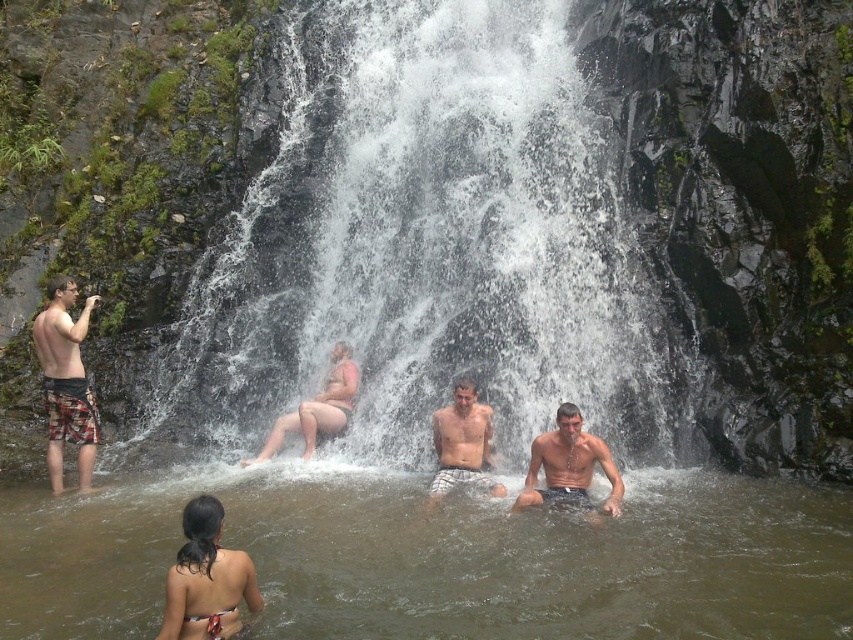
You are a photographer trying to capture both the multicolored bikini at lower left and the smooth tan skin at center in a single shot. Which object should you focus on first to ensure both are in frame?

The multicolored bikini at lower left is larger in size than the smooth tan skin at center, so you should focus on the multicolored bikini at lower left first to ensure both are in frame.

You are a photographer trying to capture the group at the waterfall. You notice the gray plaid shorts at center and the smooth tan skin at center are both in your frame. Which object should you focus on if you want to ensure the larger one is sharp?

You should focus on the gray plaid shorts at center because it is bigger than the smooth tan skin at center, making it the larger object in the frame.

What object is located at the point with coordinates (206, 579) in the image?

The multicolored bikini at lower left is located at point (206, 579).